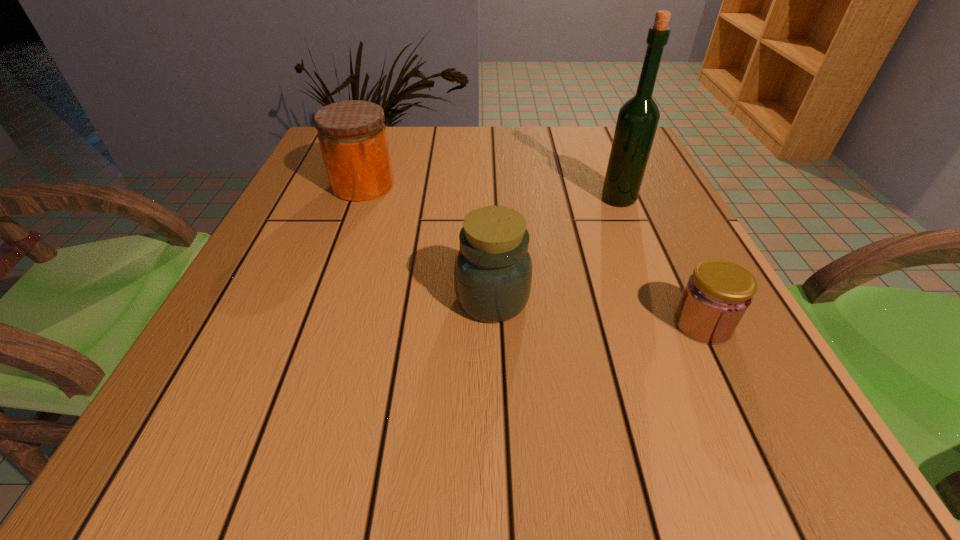
I want to click on object located in the far edge section of the desktop, so click(352, 135).

I want to click on object that is at the left edge, so click(x=352, y=135).

This screenshot has width=960, height=540. I want to click on liquor situated at the right edge, so click(x=638, y=118).

Locate an element on the screen. jam that is positioned at the right edge is located at coordinates pyautogui.click(x=717, y=295).

The height and width of the screenshot is (540, 960). Find the location of `object present at the far left corner`. object present at the far left corner is located at coordinates (352, 135).

Locate an element on the screen. vacant space at the far edge of the desktop is located at coordinates (394, 132).

Identify the location of vacant region at the near edge of the desktop. (477, 462).

Locate an element on the screen. Image resolution: width=960 pixels, height=540 pixels. blank space at the left edge is located at coordinates (286, 199).

The height and width of the screenshot is (540, 960). In the image, there is a desktop. Find the location of `free space at the right edge`. free space at the right edge is located at coordinates (685, 369).

This screenshot has width=960, height=540. I want to click on vacant region at the near left corner, so coord(159,455).